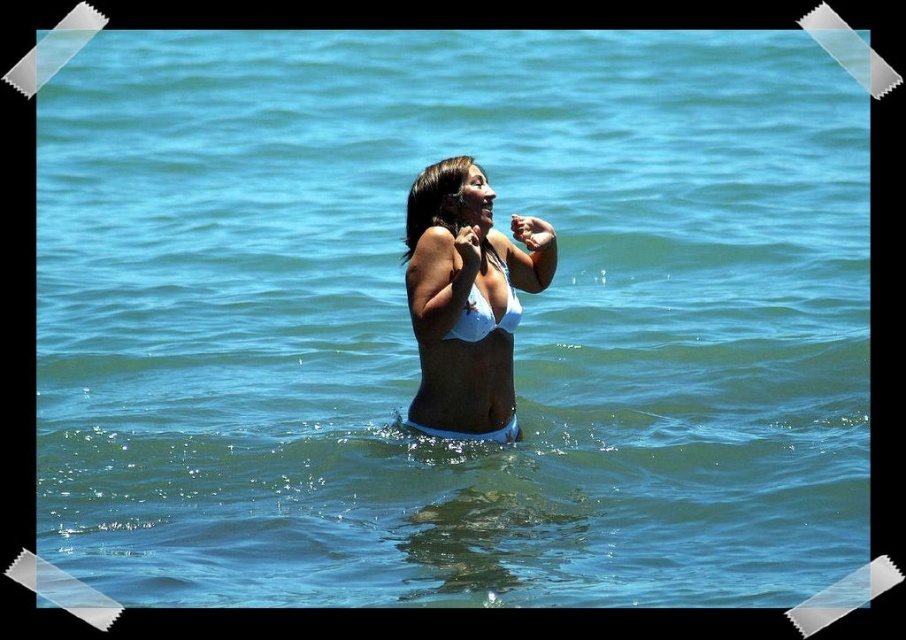
Who is more forward, (508, 291) or (500, 314)?

Point (500, 314) is in front.

Is point (471, 173) in front of point (483, 333)?

That is False.

Does point (490, 410) come in front of point (476, 333)?

That is False.

This screenshot has height=640, width=906. Find the location of `white matte bikini at center`. white matte bikini at center is located at coordinates [467, 300].